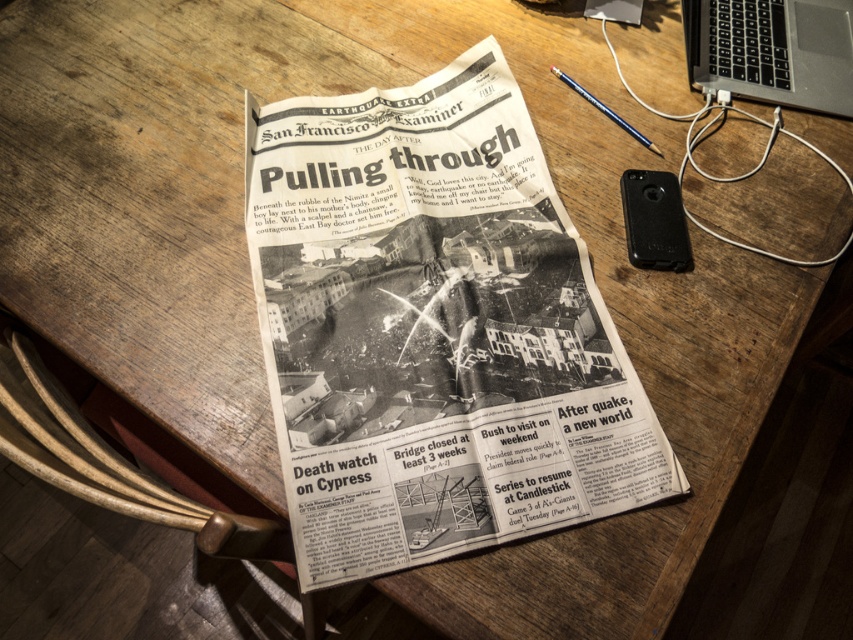
Question: Which object appears closest to the camera in this image?

Choices:
 (A) black plastic laptop at upper right
 (B) black newspaper at center

Answer: (B)

Question: Is black newspaper at center above black plastic laptop at upper right?

Choices:
 (A) no
 (B) yes

Answer: (A)

Question: Can you confirm if black newspaper at center is smaller than black plastic laptop at upper right?

Choices:
 (A) yes
 (B) no

Answer: (B)

Question: Is black newspaper at center wider than black plastic laptop at upper right?

Choices:
 (A) yes
 (B) no

Answer: (A)

Question: Among these points, which one is nearest to the camera?

Choices:
 (A) (799, 56)
 (B) (303, 184)

Answer: (B)